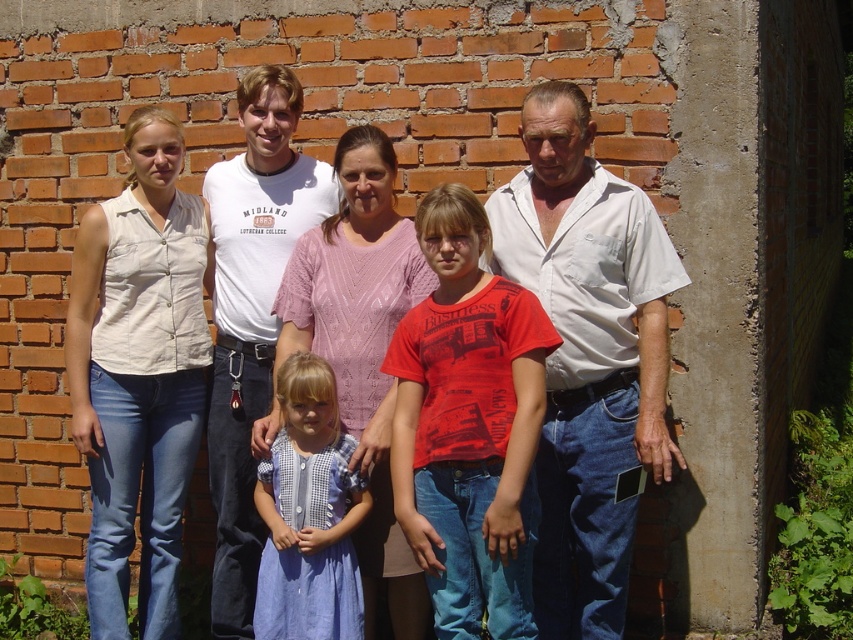
You are standing in front of the brick wall and notice the white cotton shirt at right. Can you determine if the shirt is positioned to the left or right of the center of the wall?

The white cotton shirt at right is located at point 0.555 on the horizontal axis, which is to the right of the center point at 0.5. Therefore, the shirt is positioned to the right of the wall.